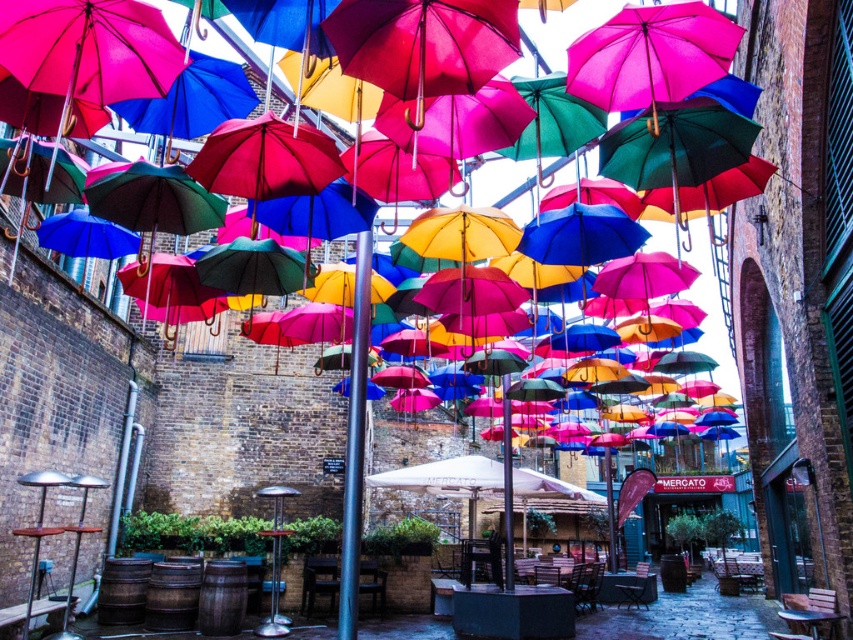
You are a city planner assessing the space between the polished metal pole at center and the white fabric umbrella at center. If you want to place a small bench here, which object should you consider moving to accommodate the bench?

The white fabric umbrella at center should be moved because the polished metal pole at center has a larger width, making it harder to move, so moving the smaller white fabric umbrella at center would be more feasible.

Based on the photo, you are standing in the courtyard and want to hang a new decorative item between the polished metal pole at center and the white fabric umbrella at center. Based on their positions, which object should you place the item closer to if you want it to be on the left side of the path?

You should place the item closer to the polished metal pole at center because it is already positioned to the left of the white fabric umbrella at center, so placing the item near it would keep it on the left side of the path.